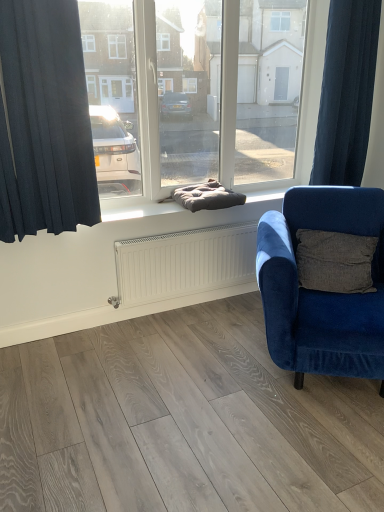
Question: Should I look upward or downward to see dark blue fabric curtain at right, the 1th curtain from the right?

Choices:
 (A) down
 (B) up

Answer: (B)

Question: Does dark gray cushion at center have a greater height compared to dark blue fabric curtain at left, marked as the second curtain in a right-to-left arrangement?

Choices:
 (A) no
 (B) yes

Answer: (A)

Question: Would you say dark gray cushion at center contains dark blue fabric curtain at left, arranged as the 2th curtain when viewed from the back?

Choices:
 (A) no
 (B) yes

Answer: (A)

Question: Is dark gray cushion at center directly adjacent to dark blue fabric curtain at left, the first curtain in the front-to-back sequence?

Choices:
 (A) yes
 (B) no

Answer: (B)

Question: From the image's perspective, is dark gray cushion at center located beneath dark blue fabric curtain at left, marked as the second curtain in a right-to-left arrangement?

Choices:
 (A) yes
 (B) no

Answer: (A)

Question: Is dark gray cushion at center wider than dark blue fabric curtain at left, the first curtain in the front-to-back sequence?

Choices:
 (A) yes
 (B) no

Answer: (A)

Question: From the image's perspective, is dark gray cushion at center on dark blue fabric curtain at left, which ranks as the 1th curtain in left-to-right order?

Choices:
 (A) no
 (B) yes

Answer: (A)

Question: Can you confirm if dark blue fabric curtain at left, the first curtain in the front-to-back sequence, is positioned to the left of velvet blue armchair at right?

Choices:
 (A) no
 (B) yes

Answer: (B)

Question: Considering the relative sizes of dark blue fabric curtain at left, the first curtain in the front-to-back sequence, and velvet blue armchair at right in the image provided, is dark blue fabric curtain at left, the first curtain in the front-to-back sequence, taller than velvet blue armchair at right?

Choices:
 (A) no
 (B) yes

Answer: (B)

Question: From a real-world perspective, does dark blue fabric curtain at left, marked as the second curtain in a right-to-left arrangement, sit lower than velvet blue armchair at right?

Choices:
 (A) yes
 (B) no

Answer: (B)

Question: Is dark blue fabric curtain at left, marked as the second curtain in a right-to-left arrangement, closer to camera compared to velvet blue armchair at right?

Choices:
 (A) no
 (B) yes

Answer: (A)

Question: Does dark blue fabric curtain at left, arranged as the 2th curtain when viewed from the back, have a greater width compared to velvet blue armchair at right?

Choices:
 (A) yes
 (B) no

Answer: (B)

Question: Considering the relative positions of dark blue fabric curtain at left, arranged as the 2th curtain when viewed from the back, and velvet blue armchair at right in the image provided, is dark blue fabric curtain at left, arranged as the 2th curtain when viewed from the back, to the right of velvet blue armchair at right from the viewer's perspective?

Choices:
 (A) yes
 (B) no

Answer: (B)

Question: Is dark gray cushion at center facing away from velvet blue armchair at right?

Choices:
 (A) no
 (B) yes

Answer: (A)